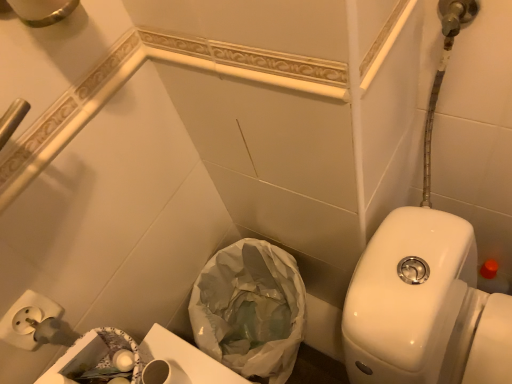
Question: Considering the positions of white glossy toilet at right and white plastic bag at lower center in the image, is white glossy toilet at right bigger or smaller than white plastic bag at lower center?

Choices:
 (A) big
 (B) small

Answer: (A)

Question: From the image's perspective, is white glossy toilet at right positioned above or below white plastic bag at lower center?

Choices:
 (A) below
 (B) above

Answer: (B)

Question: Is point [503, 322] positioned closer to the camera than point [292, 269]?

Choices:
 (A) farther
 (B) closer

Answer: (B)

Question: Considering the positions of white plastic bag at lower center and white glossy toilet at right in the image, is white plastic bag at lower center wider or thinner than white glossy toilet at right?

Choices:
 (A) wide
 (B) thin

Answer: (B)

Question: From the image's perspective, is white plastic bag at lower center located above or below white glossy toilet at right?

Choices:
 (A) above
 (B) below

Answer: (B)

Question: Visually, is white plastic bag at lower center positioned to the left or to the right of white glossy toilet at right?

Choices:
 (A) right
 (B) left

Answer: (B)

Question: Is point (239, 274) closer or farther from the camera than point (358, 337)?

Choices:
 (A) farther
 (B) closer

Answer: (A)